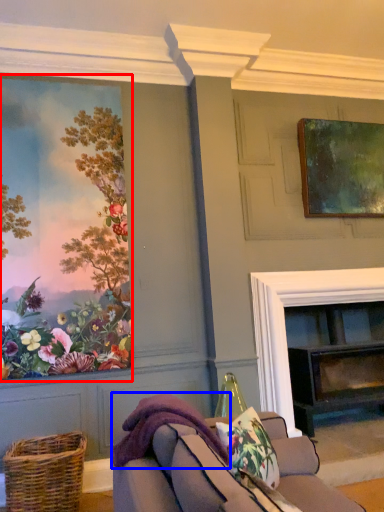
Question: Which object is further to the camera taking this photo, picture frame (highlighted by a red box) or blanket (highlighted by a blue box)?

Choices:
 (A) picture frame
 (B) blanket

Answer: (A)